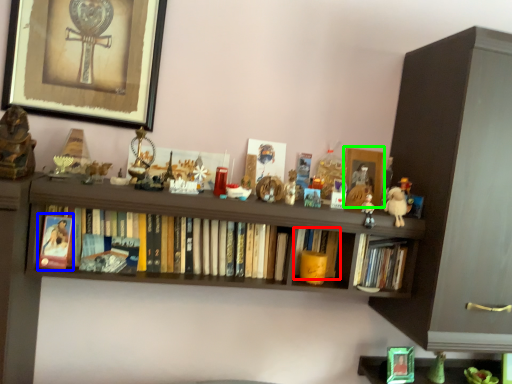
Question: Considering the real-world distances, which object is closest to book (highlighted by a red box)? paperback book (highlighted by a blue box) or picture frame (highlighted by a green box).

Choices:
 (A) paperback book
 (B) picture frame

Answer: (B)